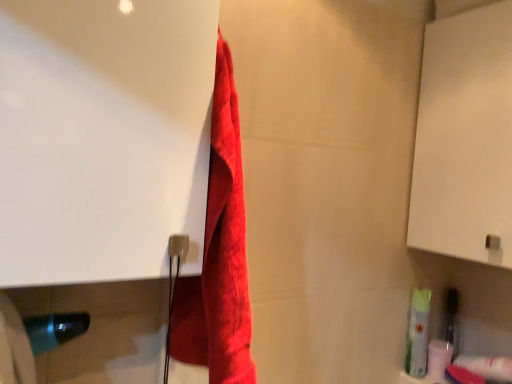
Locate an element on the screen. The image size is (512, 384). white matte toilet paper at lower right, which is the second toilet paper in back-to-front order is located at coordinates (487, 367).

You are a GUI agent. You are given a task and a screenshot of the screen. Output one action in this format:
    pyautogui.click(x=<x>, y=<y>)
    Task: Click on the white matte toilet paper at lower right, arranged as the first toilet paper when viewed from the back
    This screenshot has width=512, height=384.
    Given the screenshot: What is the action you would take?
    pyautogui.click(x=438, y=360)

What is the approximate width of white matte toilet paper at lower right, the 2th toilet paper viewed from the front?

It is 7.39 centimeters.

What do you see at coordinates (465, 139) in the screenshot? I see `white matte cabinet at upper right, which is the 2th screen door from front to back` at bounding box center [465, 139].

The image size is (512, 384). What do you see at coordinates (103, 137) in the screenshot?
I see `white glossy screen door at upper left, which is counted as the 1th screen door, starting from the left` at bounding box center [103, 137].

You are a GUI agent. You are given a task and a screenshot of the screen. Output one action in this format:
    pyautogui.click(x=<x>, y=<y>)
    Task: Click on the white glossy screen door at upper left, which ranks as the first screen door in front-to-back order
    The image size is (512, 384).
    Given the screenshot: What is the action you would take?
    point(103,137)

Find the location of `white matte toilet paper at lower right, which is the second toilet paper in back-to-front order`. white matte toilet paper at lower right, which is the second toilet paper in back-to-front order is located at coordinates (487, 367).

From a real-world perspective, which is physically above, white matte toilet paper at lower right, arranged as the first toilet paper when viewed from the back, or white matte toilet paper at lower right, which is the second toilet paper in back-to-front order?

In real-world perspective, white matte toilet paper at lower right, arranged as the first toilet paper when viewed from the back, is above.

Considering the sizes of white matte toilet paper at lower right, the 2th toilet paper viewed from the front, and white matte toilet paper at lower right, marked as the 1th toilet paper in a front-to-back arrangement, in the image, is white matte toilet paper at lower right, the 2th toilet paper viewed from the front, wider or thinner than white matte toilet paper at lower right, marked as the 1th toilet paper in a front-to-back arrangement,?

white matte toilet paper at lower right, the 2th toilet paper viewed from the front, is thinner than white matte toilet paper at lower right, marked as the 1th toilet paper in a front-to-back arrangement.

From a real-world perspective, who is located higher, red fluffy towel at center or white matte toilet paper at lower right, which is the second toilet paper in back-to-front order?

From a 3D spatial view, red fluffy towel at center is above.

At what (x,y) coordinates should I click in order to perform the action: click on the 1st toilet paper behind the red fluffy towel at center, starting your count from the anchor. Please return your answer as a coordinate pair (x, y). Looking at the image, I should click on (487, 367).

Is red fluffy towel at center placed right next to white matte toilet paper at lower right, which is the second toilet paper in back-to-front order?

No, red fluffy towel at center is not making contact with white matte toilet paper at lower right, which is the second toilet paper in back-to-front order.

Consider the image. Is white matte toilet paper at lower right, which is the second toilet paper in back-to-front order, inside red fluffy towel at center?

No, white matte toilet paper at lower right, which is the second toilet paper in back-to-front order, is located outside of red fluffy towel at center.

Does white matte toilet paper at lower right, the 2th toilet paper viewed from the front, touch white glossy screen door at upper left, the second screen door in the right-to-left sequence?

white matte toilet paper at lower right, the 2th toilet paper viewed from the front, and white glossy screen door at upper left, the second screen door in the right-to-left sequence, are clearly separated.

Which point is more forward, (442, 341) or (179, 12)?

The point (179, 12) is more forward.

Does white matte toilet paper at lower right, the 2th toilet paper viewed from the front, have a smaller size compared to white glossy screen door at upper left, the second screen door in the right-to-left sequence?

Indeed, white matte toilet paper at lower right, the 2th toilet paper viewed from the front, has a smaller size compared to white glossy screen door at upper left, the second screen door in the right-to-left sequence.

Is white matte toilet paper at lower right, the 2th toilet paper viewed from the front, at the right side of white glossy screen door at upper left, arranged as the second screen door when viewed from the back?

Indeed, white matte toilet paper at lower right, the 2th toilet paper viewed from the front, is positioned on the right side of white glossy screen door at upper left, arranged as the second screen door when viewed from the back.

How many degrees apart are the facing directions of white matte toilet paper at lower right, marked as the 1th toilet paper in a front-to-back arrangement, and white matte cabinet at upper right, the 2th screen door positioned from the left?

There is a 2.49-degree angle between the facing directions of white matte toilet paper at lower right, marked as the 1th toilet paper in a front-to-back arrangement, and white matte cabinet at upper right, the 2th screen door positioned from the left.

Could you tell me if white matte toilet paper at lower right, marked as the 1th toilet paper in a front-to-back arrangement, is facing white matte cabinet at upper right, the first screen door from the right?

No, white matte toilet paper at lower right, marked as the 1th toilet paper in a front-to-back arrangement, is not oriented towards white matte cabinet at upper right, the first screen door from the right.

Which is behind, point (490, 361) or point (509, 77)?

The point (490, 361) is farther.

Is white matte toilet paper at lower right, marked as the 1th toilet paper in a front-to-back arrangement, further to camera compared to white matte cabinet at upper right, the first screen door from the right?

Yes, white matte toilet paper at lower right, marked as the 1th toilet paper in a front-to-back arrangement, is further from the camera.

Is red fluffy towel at center looking in the opposite direction of white matte toilet paper at lower right, arranged as the first toilet paper when viewed from the back?

No, red fluffy towel at center's orientation is not away from white matte toilet paper at lower right, arranged as the first toilet paper when viewed from the back.

Is white matte toilet paper at lower right, arranged as the first toilet paper when viewed from the back, a part of red fluffy towel at center?

No, white matte toilet paper at lower right, arranged as the first toilet paper when viewed from the back, is located outside of red fluffy towel at center.

Based on the photo, between red fluffy towel at center and white matte toilet paper at lower right, the 2th toilet paper viewed from the front, which one is positioned behind?

white matte toilet paper at lower right, the 2th toilet paper viewed from the front, is further away from the camera.

Is white matte cabinet at upper right, which appears as the first screen door when viewed from the back, directly adjacent to white glossy screen door at upper left, the second screen door in the right-to-left sequence?

white matte cabinet at upper right, which appears as the first screen door when viewed from the back, and white glossy screen door at upper left, the second screen door in the right-to-left sequence, are clearly separated.

Between point (467, 174) and point (26, 185), which one is positioned in front?

Point (26, 185)

Measure the distance from white matte cabinet at upper right, the first screen door from the right, to white glossy screen door at upper left, the second screen door in the right-to-left sequence.

A distance of 30.01 inches exists between white matte cabinet at upper right, the first screen door from the right, and white glossy screen door at upper left, the second screen door in the right-to-left sequence.

Can white glossy screen door at upper left, which is counted as the 1th screen door, starting from the left, be found inside white matte cabinet at upper right, the first screen door from the right?

That's incorrect, white glossy screen door at upper left, which is counted as the 1th screen door, starting from the left, is not inside white matte cabinet at upper right, the first screen door from the right.

From the image's perspective, which object appears higher, white matte toilet paper at lower right, which is the second toilet paper in back-to-front order, or white glossy screen door at upper left, arranged as the second screen door when viewed from the back?

white glossy screen door at upper left, arranged as the second screen door when viewed from the back, is shown above in the image.

Which screen door is the 2nd one when counting from the front of the white matte toilet paper at lower right, marked as the 1th toilet paper in a front-to-back arrangement? Please provide its 2D coordinates.

[(103, 137)]

Can you confirm if white matte toilet paper at lower right, marked as the 1th toilet paper in a front-to-back arrangement, is positioned to the left of white glossy screen door at upper left, which ranks as the first screen door in front-to-back order?

No, white matte toilet paper at lower right, marked as the 1th toilet paper in a front-to-back arrangement, is not to the left of white glossy screen door at upper left, which ranks as the first screen door in front-to-back order.

This screenshot has width=512, height=384. I want to click on toilet paper above the white matte toilet paper at lower right, marked as the 1th toilet paper in a front-to-back arrangement (from a real-world perspective), so click(438, 360).

At what (x,y) coordinates should I click in order to perform the action: click on the 2nd toilet paper below the red fluffy towel at center (from the image's perspective). Please return your answer as a coordinate pair (x, y). Looking at the image, I should click on point(487,367).

Looking at the image, which one is located closer to white matte toilet paper at lower right, the 2th toilet paper viewed from the front, white glossy screen door at upper left, the second screen door in the right-to-left sequence, or white matte cabinet at upper right, the 2th screen door positioned from the left?

white matte cabinet at upper right, the 2th screen door positioned from the left, is closer to white matte toilet paper at lower right, the 2th toilet paper viewed from the front.

Based on their spatial positions, is white matte toilet paper at lower right, the 2th toilet paper viewed from the front, or white matte toilet paper at lower right, marked as the 1th toilet paper in a front-to-back arrangement, further from white glossy screen door at upper left, arranged as the second screen door when viewed from the back?

Among the two, white matte toilet paper at lower right, marked as the 1th toilet paper in a front-to-back arrangement, is located further to white glossy screen door at upper left, arranged as the second screen door when viewed from the back.

Estimate the real-world distances between objects in this image. Which object is closer to white matte cabinet at upper right, the 2th screen door positioned from the left, white glossy screen door at upper left, which is counted as the 1th screen door, starting from the left, or white matte toilet paper at lower right, marked as the 1th toilet paper in a front-to-back arrangement?

Among the two, white matte toilet paper at lower right, marked as the 1th toilet paper in a front-to-back arrangement, is located nearer to white matte cabinet at upper right, the 2th screen door positioned from the left.

Considering their positions, is red fluffy towel at center positioned closer to white matte cabinet at upper right, which is the 2th screen door from front to back, than white matte toilet paper at lower right, arranged as the first toilet paper when viewed from the back?

white matte toilet paper at lower right, arranged as the first toilet paper when viewed from the back, lies closer to white matte cabinet at upper right, which is the 2th screen door from front to back, than the other object.

Considering their positions, is white matte cabinet at upper right, the 2th screen door positioned from the left, positioned further to white matte toilet paper at lower right, which is the second toilet paper in back-to-front order, than red fluffy towel at center?

red fluffy towel at center lies further to white matte toilet paper at lower right, which is the second toilet paper in back-to-front order, than the other object.

Considering their positions, is white matte toilet paper at lower right, which is the second toilet paper in back-to-front order, positioned closer to white matte cabinet at upper right, which is the 2th screen door from front to back, than white matte toilet paper at lower right, the 2th toilet paper viewed from the front?

Based on the image, white matte toilet paper at lower right, which is the second toilet paper in back-to-front order, appears to be nearer to white matte cabinet at upper right, which is the 2th screen door from front to back.

Considering their positions, is red fluffy towel at center positioned closer to white glossy screen door at upper left, which is counted as the 1th screen door, starting from the left, than white matte toilet paper at lower right, arranged as the first toilet paper when viewed from the back?

Based on the image, red fluffy towel at center appears to be nearer to white glossy screen door at upper left, which is counted as the 1th screen door, starting from the left.

In the scene shown: Estimate the real-world distances between objects in this image. Which object is closer to white matte cabinet at upper right, which appears as the first screen door when viewed from the back, white matte toilet paper at lower right, marked as the 1th toilet paper in a front-to-back arrangement, or red fluffy towel at center?

white matte toilet paper at lower right, marked as the 1th toilet paper in a front-to-back arrangement, is closer to white matte cabinet at upper right, which appears as the first screen door when viewed from the back.

At what (x,y) coordinates should I click in order to perform the action: click on toilet paper between white matte cabinet at upper right, the first screen door from the right, and white matte toilet paper at lower right, which is the second toilet paper in back-to-front order, from top to bottom. Please return your answer as a coordinate pair (x, y). Looking at the image, I should click on (438, 360).

Where is `towel situated between white glossy screen door at upper left, the second screen door in the right-to-left sequence, and white matte cabinet at upper right, which is the 2th screen door from front to back, from left to right`? The image size is (512, 384). towel situated between white glossy screen door at upper left, the second screen door in the right-to-left sequence, and white matte cabinet at upper right, which is the 2th screen door from front to back, from left to right is located at coordinates (218, 255).

Locate an element on the screen. towel between white glossy screen door at upper left, the second screen door in the right-to-left sequence, and white matte toilet paper at lower right, which is the second toilet paper in back-to-front order, from left to right is located at coordinates (218, 255).

Locate an element on the screen. The width and height of the screenshot is (512, 384). toilet paper between red fluffy towel at center and white matte toilet paper at lower right, which is the second toilet paper in back-to-front order, from left to right is located at coordinates (438, 360).